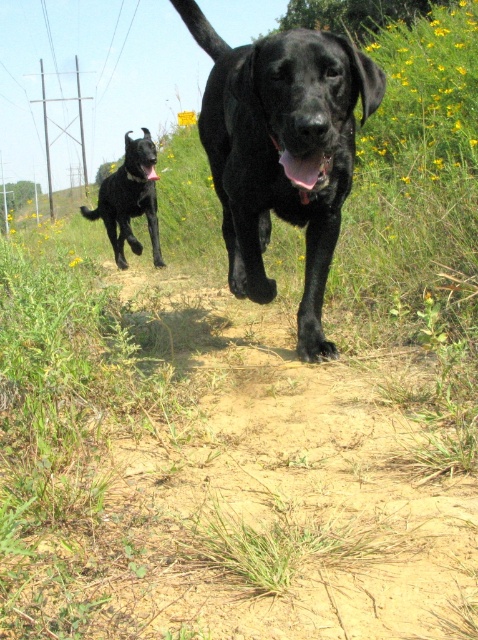
You are a photographer trying to capture both dogs in a single shot. Given that your camera has a fixed focus on the shiny black dog at center, will the shiny black dog at upper left also be in focus?

The shiny black dog at upper left will also be in focus because the camera is focused on the shiny black dog at center, and both are positioned along the same path, likely within the same focal plane.

You are a photographer standing at the starting point of the dirt path. You want to take a photo of both shiny black dog at center and shiny black dog at upper left in the same frame. Given that your camera has a maximum focus range of 3 meters, will both dogs be in focus?

The shiny black dog at center is 3.64 meters away from shiny black dog at upper left. Since the distance between them exceeds the camera focus range of 3 meters, both dogs cannot be in focus simultaneously.

Based on the photo, you are a photographer trying to capture a photo of both the shiny black dog at center and the shiny black dog at upper left. Since you want to ensure both dogs are in focus, you need to know which one is taller. Can you tell me which dog is taller?

The shiny black dog at center is taller than the shiny black dog at upper left.